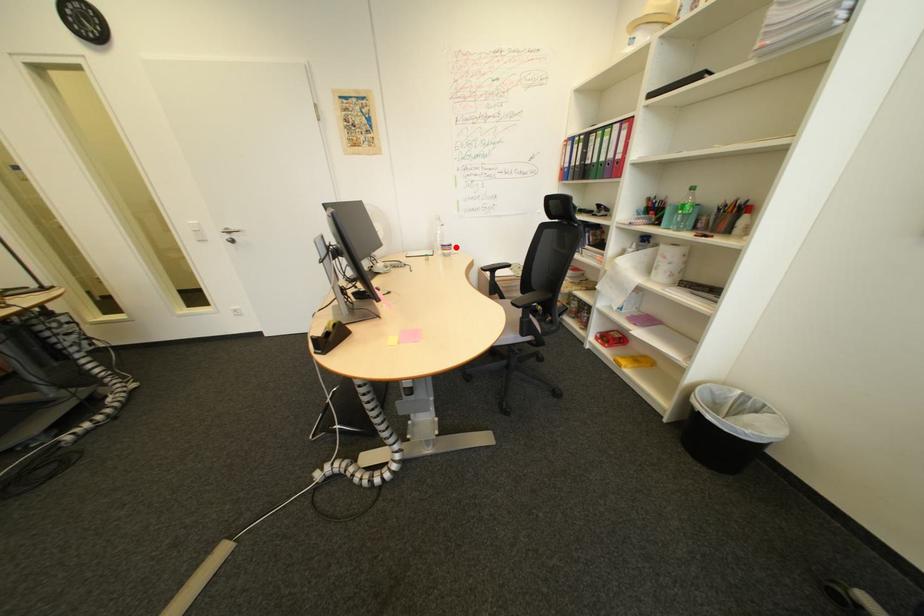
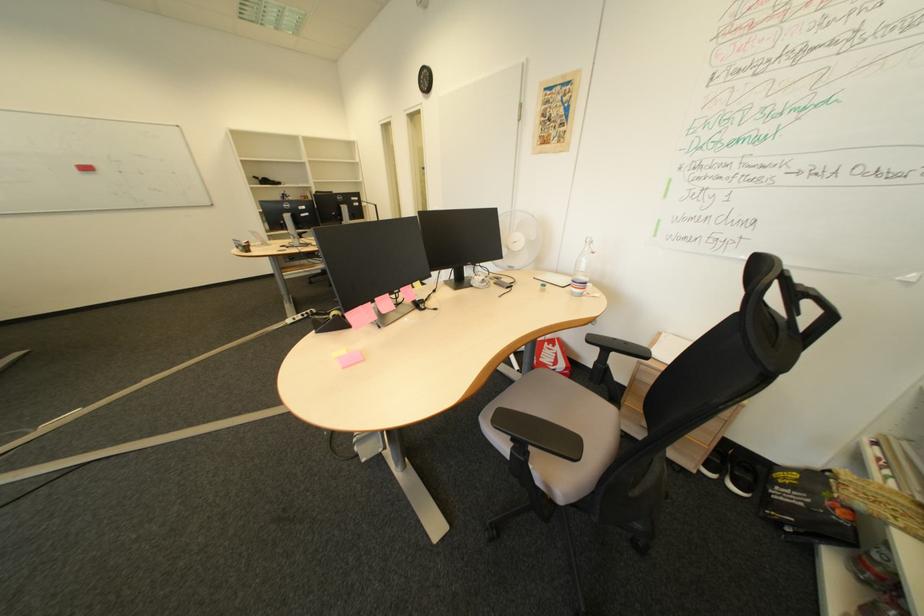
Find the pixel in the second image that matches the highlighted location in the first image.

(587, 282)